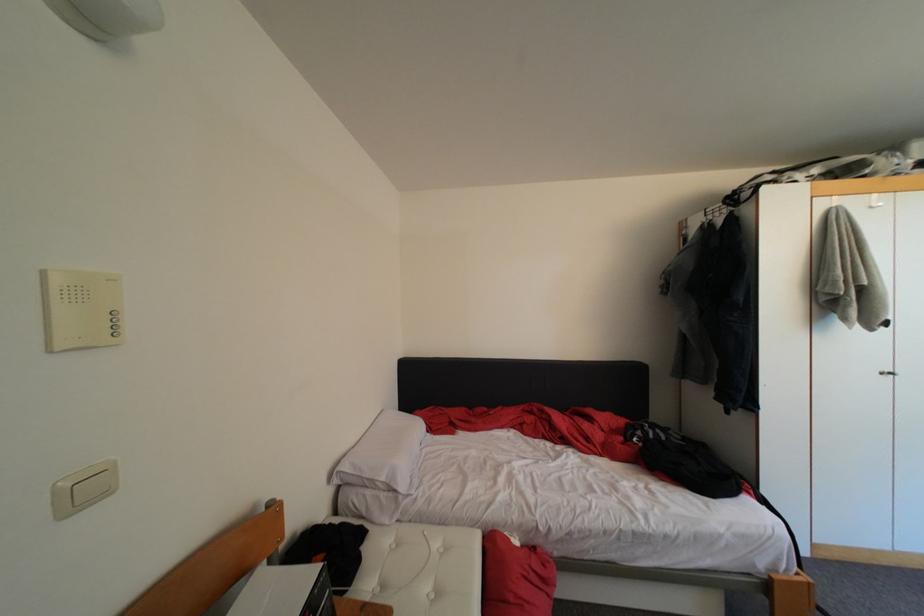
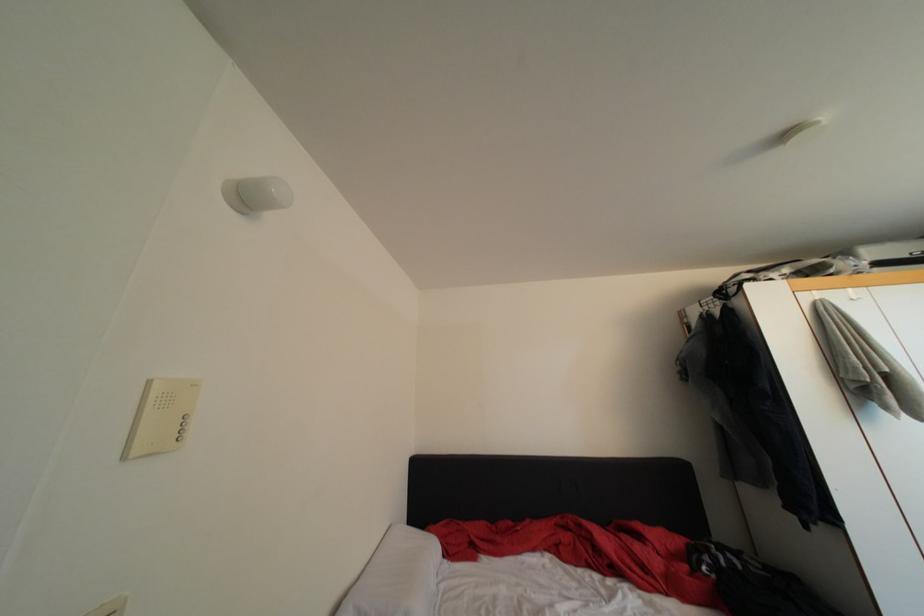
In a continuous first-person perspective shot, in which direction is the camera moving?

The cameraman walked toward left, backward.